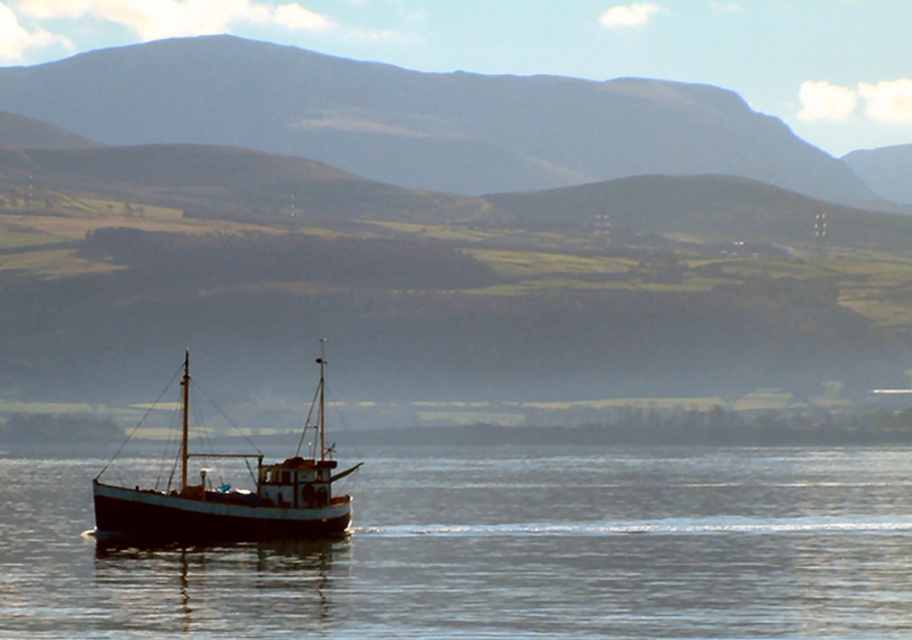
You are a photographer planning to capture the reflection of the smooth water at center and the gray rocky mountain at upper center. Since you want the reflection to be clearly visible, which object should you focus on to ensure the reflection is not obstructed by the other?

The smooth water at center has a lesser height compared to the gray rocky mountain at upper center. Therefore, focusing on the smooth water at center will ensure the reflection is not obstructed by the taller gray rocky mountain at upper center.

You are an observer standing at the edge of the water. You see the smooth water at center and the white matte boat at lower left. Which object appears taller from your viewpoint?

The white matte boat at lower left appears taller than the smooth water at center because the smooth water at center is not as tall as the white matte boat at lower left.

You are standing on the shore and see the smooth water at center and the white matte boat at lower left. Which object is closer to your right side?

The smooth water at center is to the right of white matte boat at lower left, so the smooth water at center is closer to your right side.